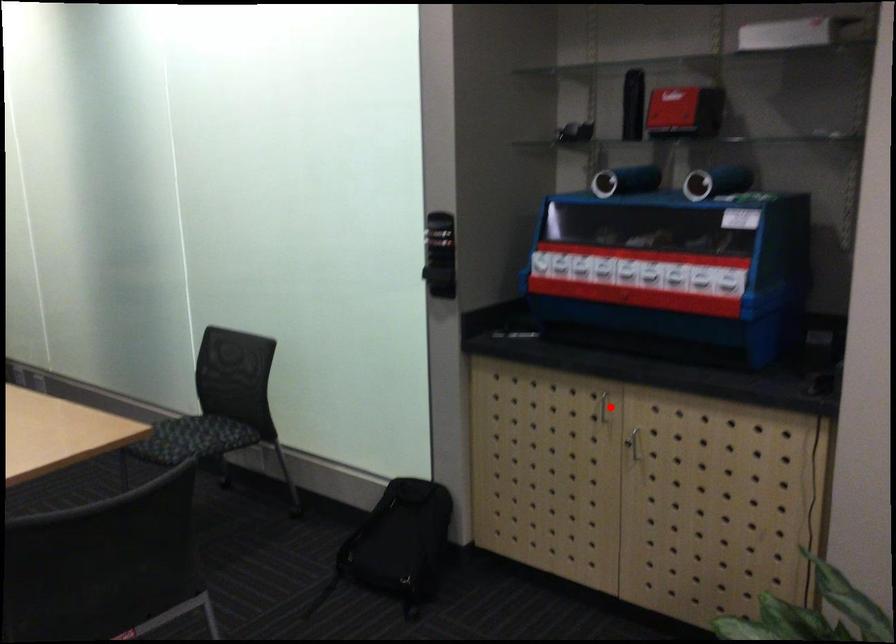
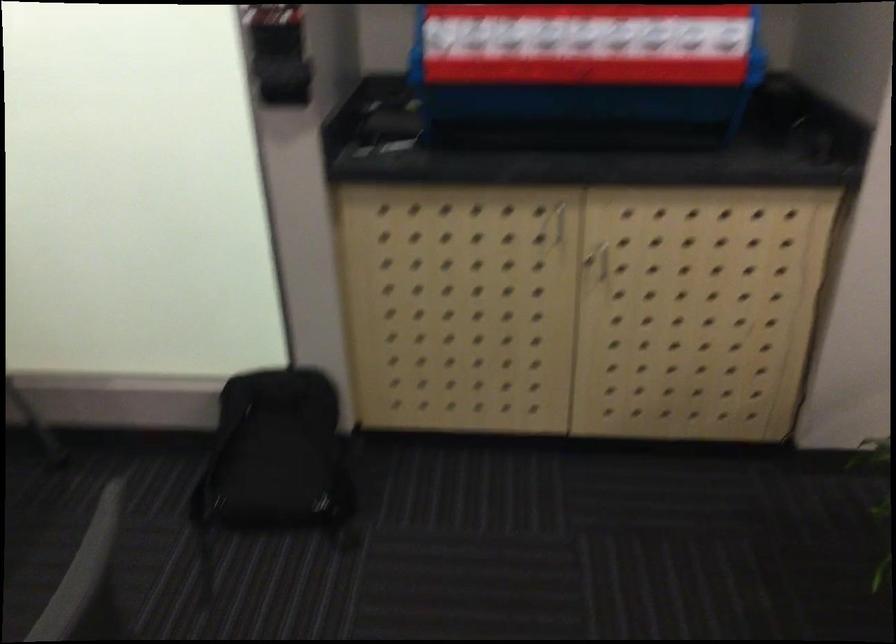
Find the pixel in the second image that matches the highlighted location in the first image.

(558, 223)